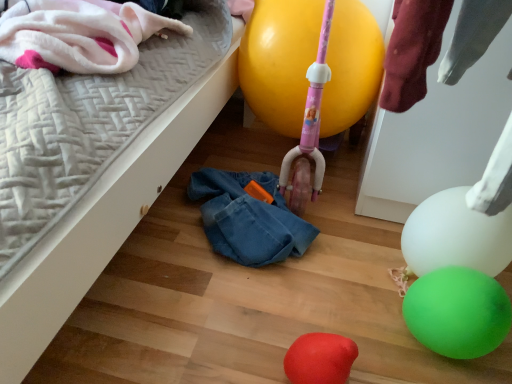
You are a GUI agent. You are given a task and a screenshot of the screen. Output one action in this format:
    pyautogui.click(x=<x>, y=<y>)
    Task: Click on the free space to the left of white glossy balloon at lower right, marked as the second balloon in a top-to-bottom arrangement
    This screenshot has width=512, height=384.
    Given the screenshot: What is the action you would take?
    pyautogui.click(x=359, y=270)